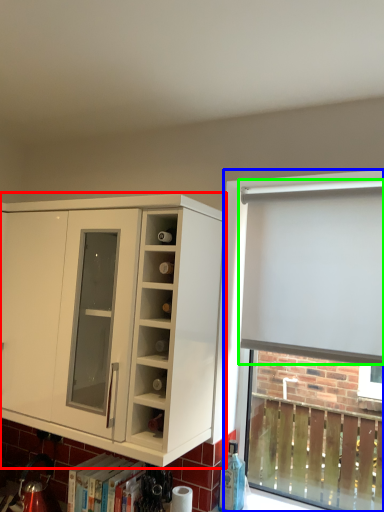
Question: Which is nearer to the cabinetry (highlighted by a red box)? bay window (highlighted by a blue box) or curtain (highlighted by a green box).

Choices:
 (A) bay window
 (B) curtain

Answer: (B)